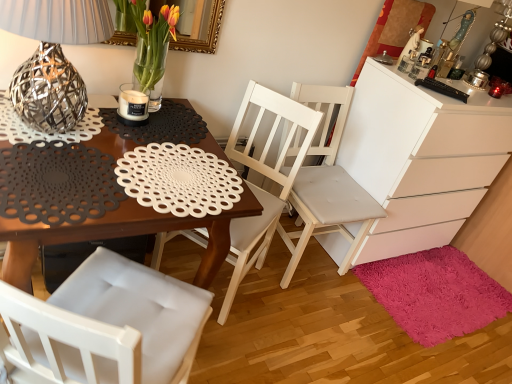
Locate an element on the screen. This screenshot has width=512, height=384. free region on the left part of white matte candle at table is located at coordinates (104, 107).